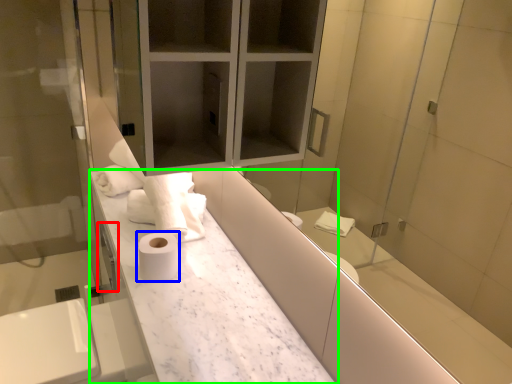
Question: Based on their relative distances, which object is farther from faucet (highlighted by a red box)? Choose from toilet paper (highlighted by a blue box) and counter (highlighted by a green box).

Choices:
 (A) toilet paper
 (B) counter

Answer: (B)